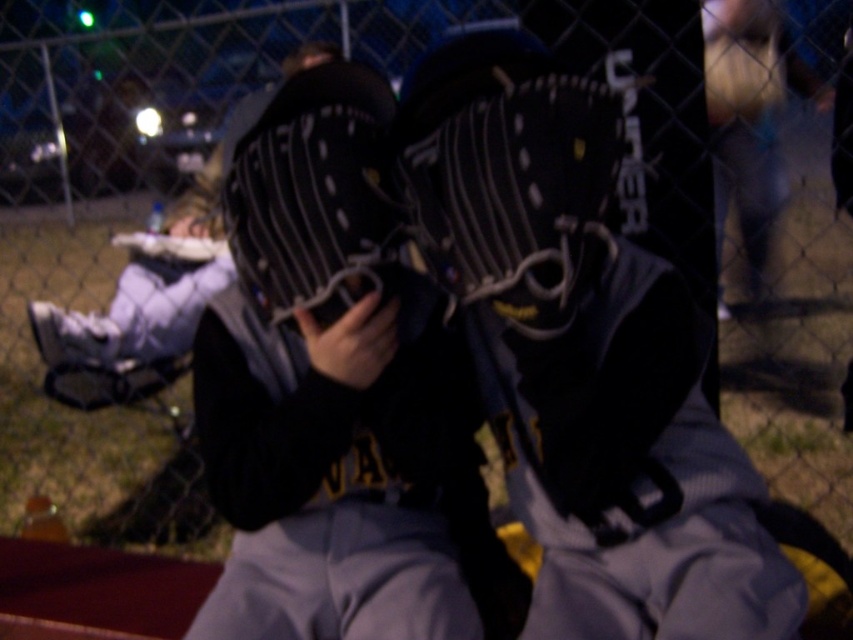
Question: Which of the following is the closest to the observer?

Choices:
 (A) black matte baseball uniform at center
 (B) dark blue jersey at center
 (C) black leather baseball glove at left
 (D) black leather baseball glove at center

Answer: (D)

Question: Which object is the farthest from the black leather baseball glove at left?

Choices:
 (A) dark blue jersey at center
 (B) black leather baseball glove at center

Answer: (A)

Question: Which point is farther to the camera?

Choices:
 (A) (535, 157)
 (B) (155, 264)

Answer: (B)

Question: Can you confirm if black leather baseball glove at center is smaller than black leather baseball glove at left?

Choices:
 (A) yes
 (B) no

Answer: (A)

Question: Does dark blue jersey at center have a larger size compared to black matte baseball uniform at center?

Choices:
 (A) yes
 (B) no

Answer: (A)

Question: Is dark blue jersey at center bigger than black leather baseball glove at center?

Choices:
 (A) no
 (B) yes

Answer: (B)